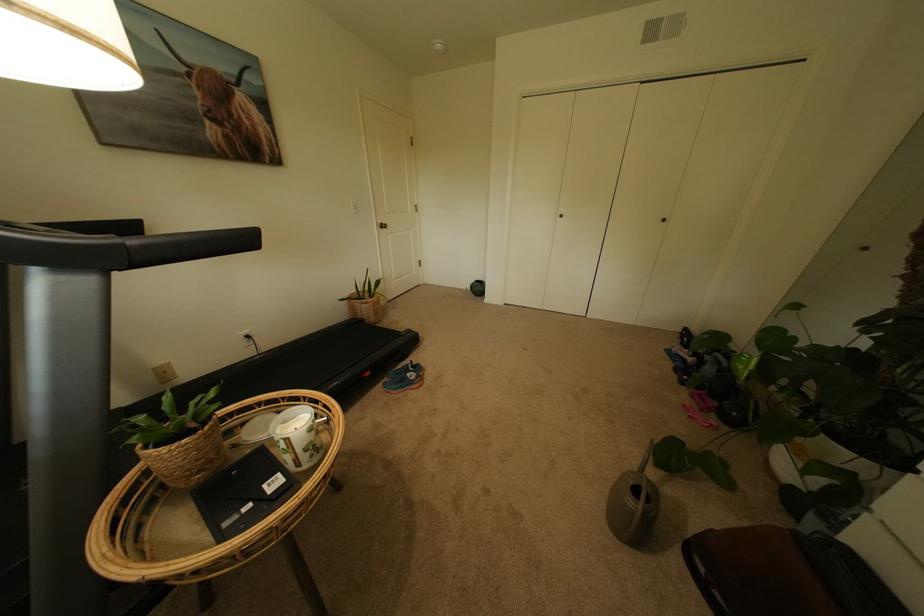
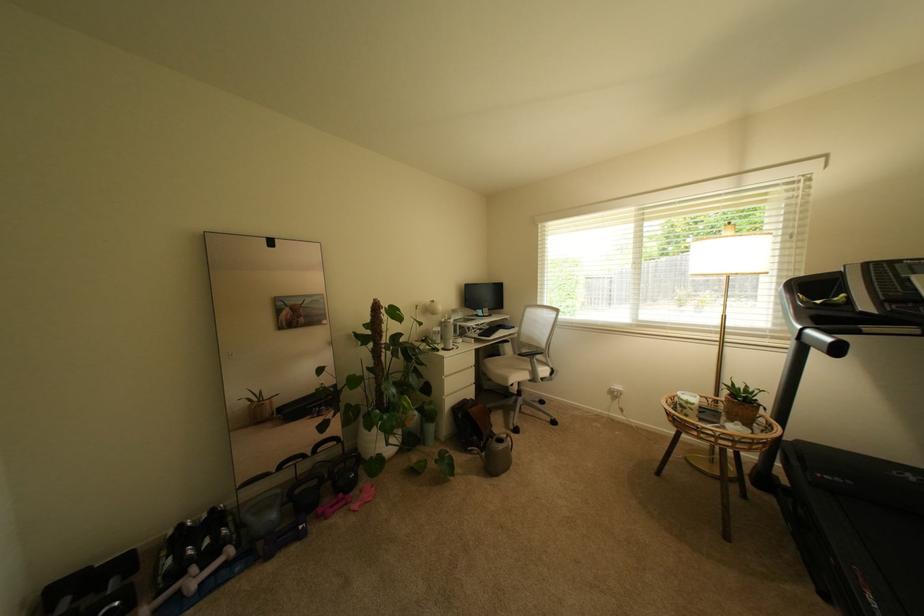
The point at (723, 416) is marked in the first image. Where is the corresponding point in the second image?

(359, 495)